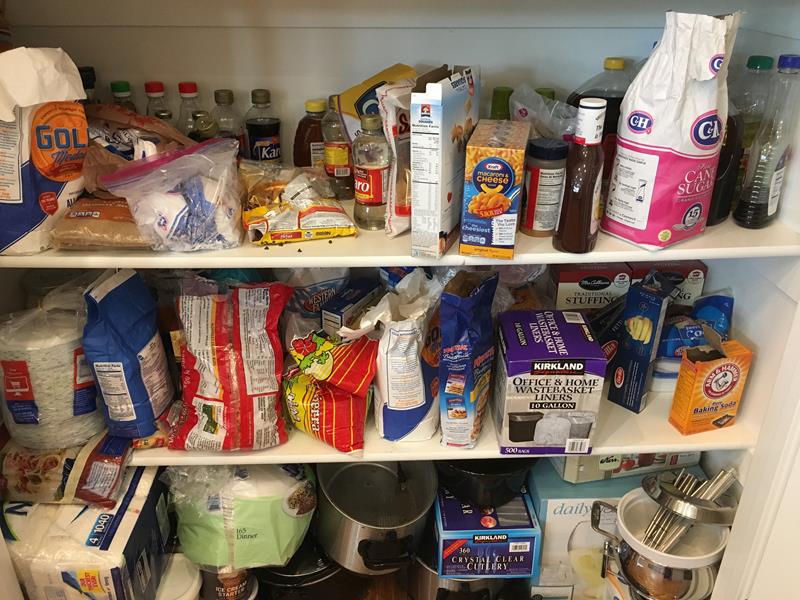
Locate an element on the screen. Image resolution: width=800 pixels, height=600 pixels. stuffing is located at coordinates (570, 280).